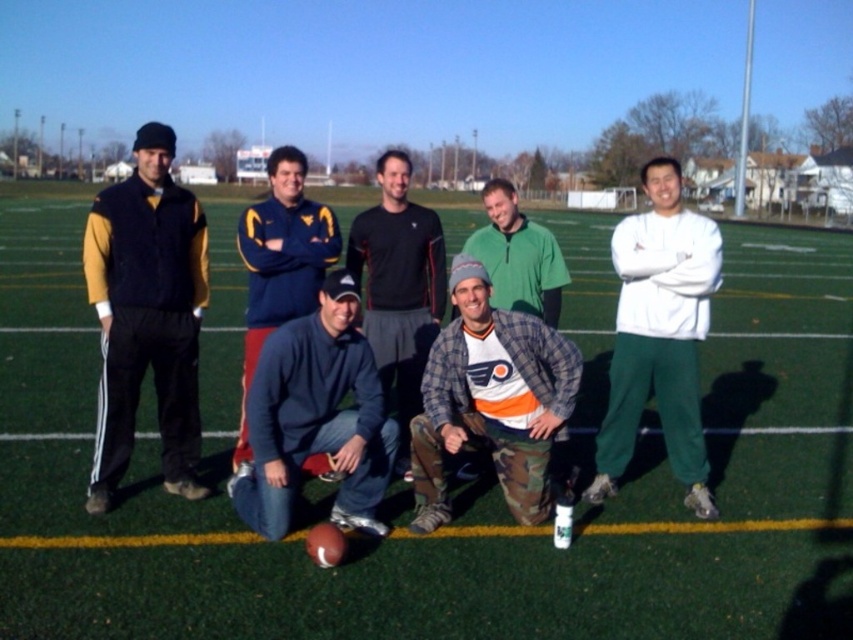
Question: Is dark blue fleece at center to the right of green fleece jacket at center from the viewer's perspective?

Choices:
 (A) yes
 (B) no

Answer: (B)

Question: Which object is closer to the camera taking this photo?

Choices:
 (A) white fleece sweatshirt at right
 (B) blue fleece at center

Answer: (B)

Question: Considering the real-world distances, which object is farthest from the matte black vest at left?

Choices:
 (A) dark blue fleece at center
 (B) camo pants at center
 (C) white fleece sweatshirt at right
 (D) green fleece jacket at center

Answer: (C)

Question: Which of the following is the closest to the observer?

Choices:
 (A) blue fleece at center
 (B) matte black vest at left
 (C) green fleece jacket at center
 (D) black mesh shirt at center

Answer: (A)

Question: Is camo pants at center bigger than white fleece sweatshirt at right?

Choices:
 (A) no
 (B) yes

Answer: (A)

Question: In this image, where is blue fleece at center located relative to dark blue fleece at center?

Choices:
 (A) above
 (B) below

Answer: (B)